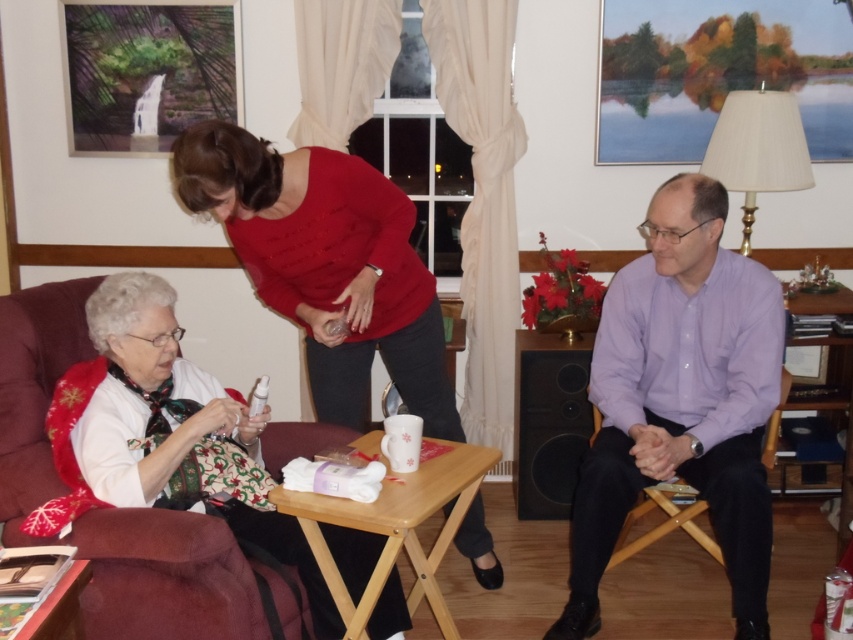
You are organizing a small gathering and need to decide which item to place on the narrower shelf. You have the matte red sweater at center and the white fabric at left. Based on their sizes, which one would fit better?

The matte red sweater at center is thinner than the white fabric at left, so it would fit better on the narrower shelf.